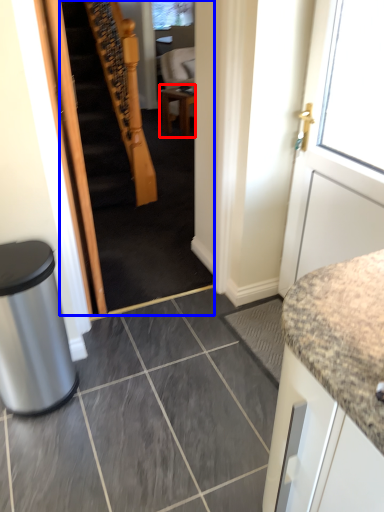
Question: Which of the following is the farthest to the observer, table (highlighted by a red box) or stairwell (highlighted by a blue box)?

Choices:
 (A) table
 (B) stairwell

Answer: (A)